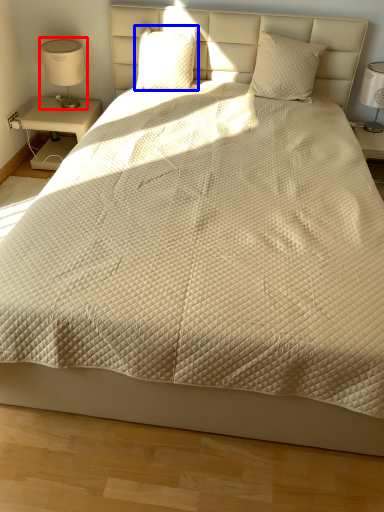
Question: Among these objects, which one is farthest to the camera, table lamp (highlighted by a red box) or pillow (highlighted by a blue box)?

Choices:
 (A) table lamp
 (B) pillow

Answer: (A)